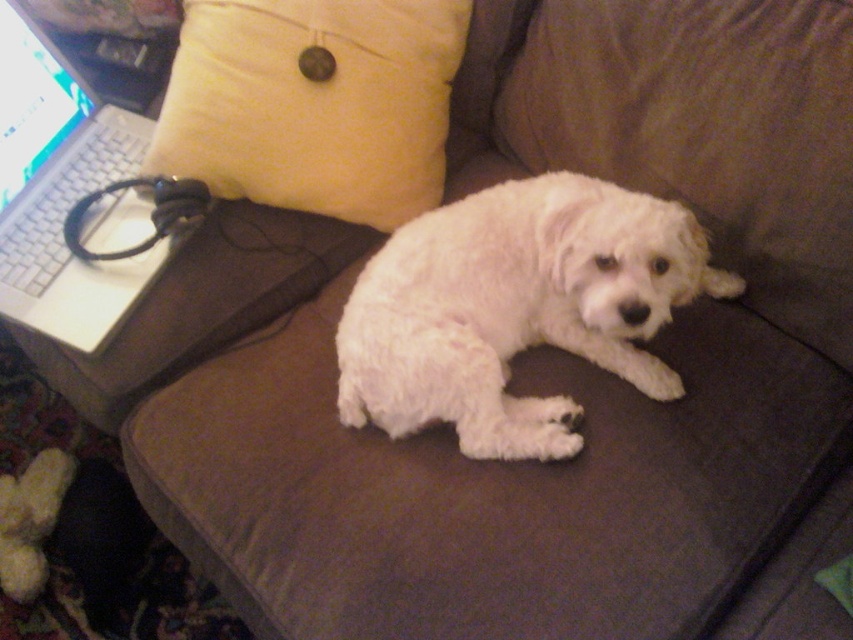
Describe the element at coordinates (515, 308) in the screenshot. I see `white fluffy dog at center` at that location.

Who is more forward, [492,444] or [434,116]?

Point [492,444] is in front.

Identify the location of white fluffy dog at center. (515, 308).

This screenshot has width=853, height=640. Identify the location of white fluffy dog at center. (515, 308).

Does white fluffy dog at center have a greater height compared to white plastic laptop at left?

Incorrect, white fluffy dog at center's height is not larger of white plastic laptop at left's.

Between white fluffy dog at center and white plastic laptop at left, which one appears on the right side from the viewer's perspective?

From the viewer's perspective, white fluffy dog at center appears more on the right side.

Between point (564, 170) and point (32, 102), which one is positioned in front?

Point (32, 102) is more forward.

This screenshot has width=853, height=640. What are the coordinates of `white fluffy dog at center` in the screenshot? It's located at (515, 308).

From the picture: Is yellow soft pillow at upper left taller than white plastic laptop at left?

No.

This screenshot has height=640, width=853. I want to click on yellow soft pillow at upper left, so click(x=312, y=104).

In order to click on yellow soft pillow at upper left in this screenshot , I will do `click(312, 104)`.